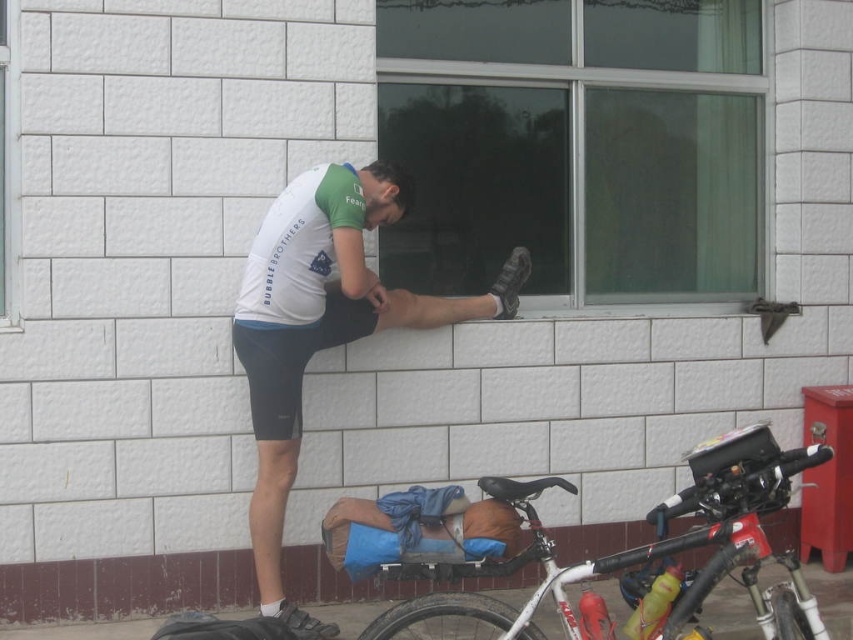
You are a photographer trying to capture the scene through the window. You notice the white matte shorts at center and the black rubber tire at lower center in your viewfinder. Which object should you adjust your camera to focus on first if you want to include both in the frame without moving the camera?

The white matte shorts at center is to the left of the black rubber tire at lower center, so you should focus on the white matte shorts at center first to ensure both are in the frame without moving the camera.

You are a delivery person who needs to park your white matte bicycle at lower center near the black rubber tire at lower center. Since the bicycle is wider than the tire, will it fit in the space between the building wall and the tire?

The white matte bicycle at lower center is wider than the black rubber tire at lower center, so it may not fit in the space between the building wall and the tire unless there is enough extra space to accommodate its greater width.

You are a delivery robot with a width of 0.8 meters. You need to navigate through the space between the white matte shorts at center and the white matte bicycle at lower center. Can you fit through this space?

The distance between the white matte shorts at center and the white matte bicycle at lower center is 1.37 meters. Since your width is 0.8 meters, you can fit through the space as it is wider than your robot.